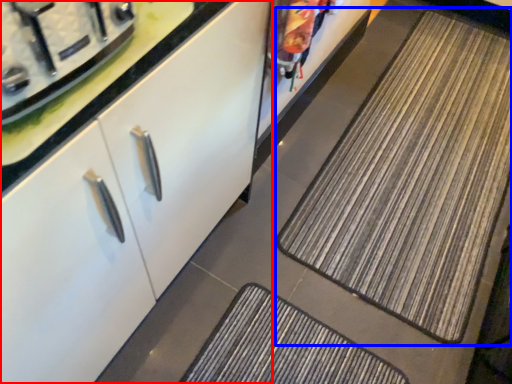
Question: Which object is closer to the camera taking this photo, cabinetry (highlighted by a red box) or mat (highlighted by a blue box)?

Choices:
 (A) cabinetry
 (B) mat

Answer: (A)